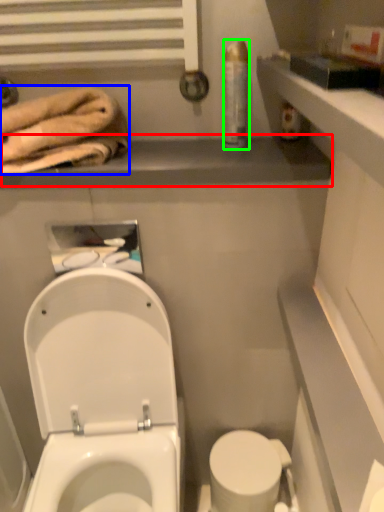
Question: Which object is positioned closest to balustrade (highlighted by a red box)? Select from bath towel (highlighted by a blue box) and toiletry (highlighted by a green box).

Choices:
 (A) bath towel
 (B) toiletry

Answer: (A)